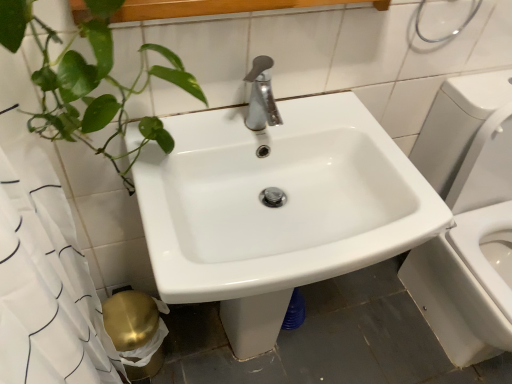
Question: From a real-world perspective, is white paper at lower left under white glossy sink at center?

Choices:
 (A) yes
 (B) no

Answer: (A)

Question: Is white glossy sink at center located within white paper at lower left?

Choices:
 (A) no
 (B) yes

Answer: (A)

Question: Is white paper at lower left behind white glossy sink at center?

Choices:
 (A) no
 (B) yes

Answer: (B)

Question: From the image's perspective, is white paper at lower left located above white glossy sink at center?

Choices:
 (A) yes
 (B) no

Answer: (B)

Question: Can you confirm if white paper at lower left is thinner than white glossy sink at center?

Choices:
 (A) no
 (B) yes

Answer: (B)

Question: Considering the relative positions of white paper at lower left and white glossy sink at center in the image provided, is white paper at lower left to the right of white glossy sink at center from the viewer's perspective?

Choices:
 (A) no
 (B) yes

Answer: (A)

Question: Are white glossy sink at center and white paper at lower left located far from each other?

Choices:
 (A) no
 (B) yes

Answer: (A)

Question: Can you confirm if white glossy sink at center is positioned to the left of white paper at lower left?

Choices:
 (A) yes
 (B) no

Answer: (B)

Question: Does white glossy sink at center appear on the right side of white paper at lower left?

Choices:
 (A) no
 (B) yes

Answer: (B)

Question: Is white glossy sink at center bigger than white paper at lower left?

Choices:
 (A) yes
 (B) no

Answer: (A)

Question: Does white glossy sink at center have a smaller size compared to white paper at lower left?

Choices:
 (A) no
 (B) yes

Answer: (A)

Question: Can you confirm if white glossy sink at center is thinner than white paper at lower left?

Choices:
 (A) no
 (B) yes

Answer: (A)

Question: Relative to white glossy sink at center, is white paper at lower left in front or behind?

Choices:
 (A) behind
 (B) front

Answer: (A)